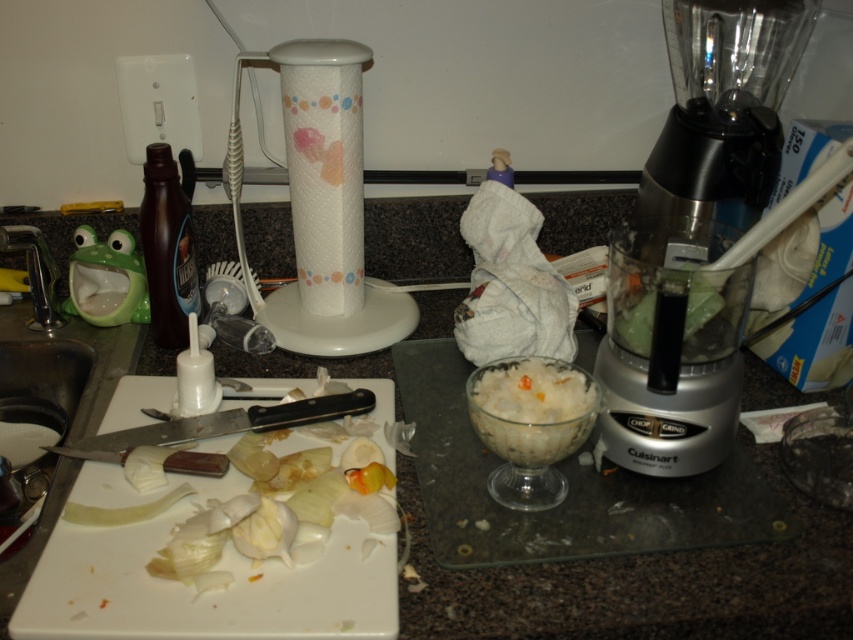
Question: Which of the following is the closest to the observer?

Choices:
 (A) (486, 401)
 (B) (634, 310)
 (C) (369, 561)
 (D) (294, 132)

Answer: (C)

Question: Which point appears farthest from the camera in this image?

Choices:
 (A) (120, 493)
 (B) (618, 384)

Answer: (B)

Question: Which object appears farthest from the camera in this image?

Choices:
 (A) white plastic cutting board at lower left
 (B) white translucent bowl at center

Answer: (B)

Question: Does granite gray counter top at center appear under white translucent bowl at center?

Choices:
 (A) yes
 (B) no

Answer: (B)

Question: Considering the relative positions of granite gray counter top at center and metallic silver blender at right in the image provided, where is granite gray counter top at center located with respect to metallic silver blender at right?

Choices:
 (A) above
 (B) below

Answer: (B)

Question: Is the position of white plastic cutting board at lower left more distant than that of green leafy vegetable at center?

Choices:
 (A) yes
 (B) no

Answer: (B)